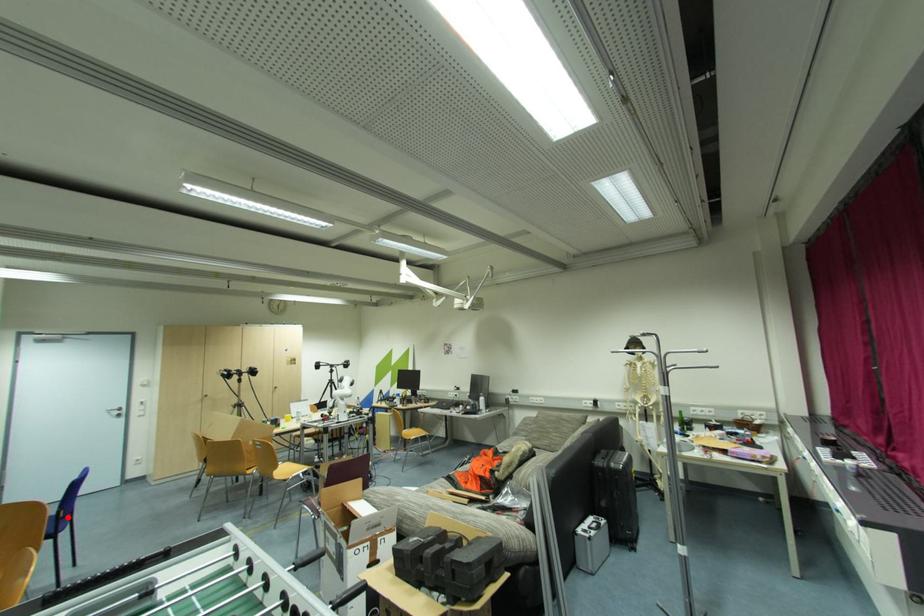
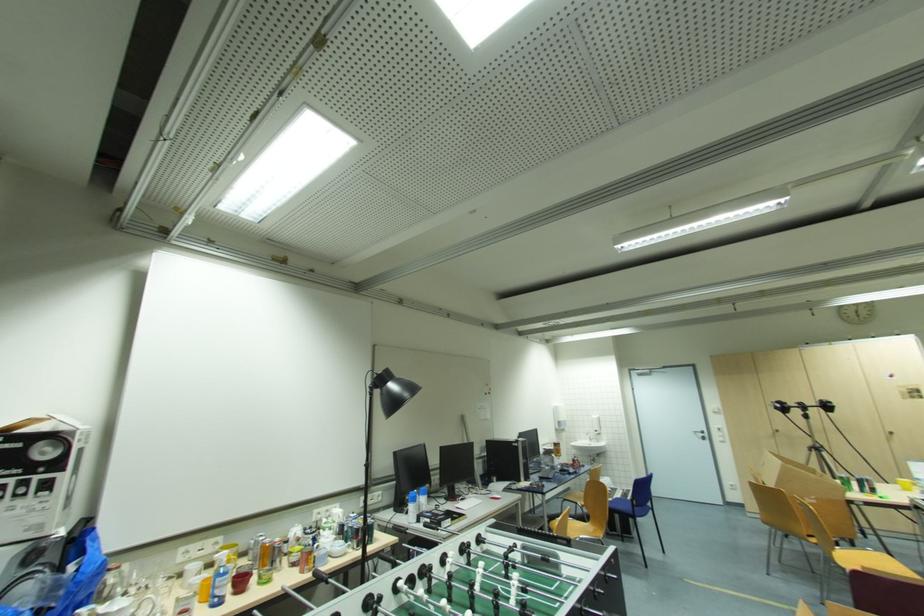
Question: I am providing you with two images of the same scene from different viewpoints. Given a red point in image1, look at the same physical point in image2. Is it:

Choices:
 (A) Closer to the viewpoint
 (B) Farther from the viewpoint

Answer: (A)